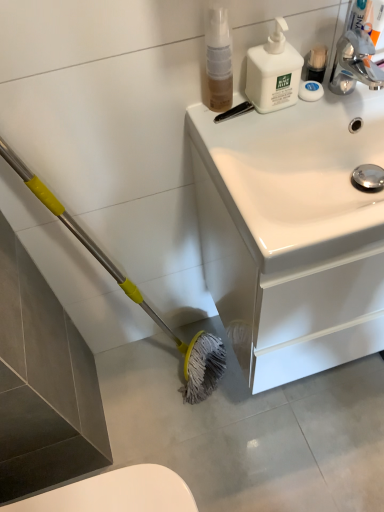
Locate an element on the screen. white glossy sink at upper right is located at coordinates tap(294, 230).

From the image's perspective, is white glossy sink at upper right positioned above or below white matte soap at upper right?

Based on their image positions, white glossy sink at upper right is located beneath white matte soap at upper right.

Does point (266, 195) come in front of point (319, 94)?

Yes, it is.

Is white glossy sink at upper right touching white matte soap at upper right?

No, white glossy sink at upper right is not making contact with white matte soap at upper right.

Could you tell me if white glossy sink at upper right is turned towards white matte soap at upper right?

No.

How many degrees apart are the facing directions of white matte soap at upper right and white glossy sink at upper right?

2.67 degrees.

Is white matte soap at upper right turned away from white glossy sink at upper right?

No, white glossy sink at upper right is not at the back of white matte soap at upper right.

From the image's perspective, does white matte soap at upper right appear higher than white glossy sink at upper right?

Indeed, from the image's perspective, white matte soap at upper right is shown above white glossy sink at upper right.

Consider the image. Is white matte soap at upper right next to white glossy sink at upper right and touching it?

white matte soap at upper right and white glossy sink at upper right are clearly separated.

Considering the relative sizes of translucent plastic spray bottle at upper center, marked as the 1th cleaning product in a left-to-right arrangement, and white glossy sink at upper right in the image provided, is translucent plastic spray bottle at upper center, marked as the 1th cleaning product in a left-to-right arrangement, shorter than white glossy sink at upper right?

Yes, translucent plastic spray bottle at upper center, marked as the 1th cleaning product in a left-to-right arrangement, is shorter than white glossy sink at upper right.

What's the angular difference between translucent plastic spray bottle at upper center, marked as the 1th cleaning product in a left-to-right arrangement, and white glossy sink at upper right's facing directions?

The angular difference between translucent plastic spray bottle at upper center, marked as the 1th cleaning product in a left-to-right arrangement, and white glossy sink at upper right is 3.02 degrees.

Could you tell me if translucent plastic spray bottle at upper center, marked as the 1th cleaning product in a left-to-right arrangement, is turned towards white glossy sink at upper right?

No.

In terms of size, does translucent plastic spray bottle at upper center, placed as the 2th cleaning product when sorted from right to left, appear bigger or smaller than white glossy sink at upper right?

Considering their sizes, translucent plastic spray bottle at upper center, placed as the 2th cleaning product when sorted from right to left, takes up less space than white glossy sink at upper right.

Looking at this image, which is more to the right, white matte pump bottle at upper right, which appears as the 1th cleaning product when viewed from the right, or white matte soap at upper right?

From the viewer's perspective, white matte soap at upper right appears more on the right side.

From a real-world perspective, starting from the white matte soap at upper right, which cleaning product is the 1st one vertically above it? Please provide its 2D coordinates.

[(273, 72)]

Is white matte pump bottle at upper right, the second cleaning product in the left-to-right sequence, placed right next to white matte soap at upper right?

Yes, white matte pump bottle at upper right, the second cleaning product in the left-to-right sequence, is with white matte soap at upper right.

Between white matte pump bottle at upper right, which appears as the 1th cleaning product when viewed from the right, and white matte soap at upper right, which one is positioned in front?

white matte pump bottle at upper right, which appears as the 1th cleaning product when viewed from the right, is more forward.

Who is bigger, white matte pump bottle at upper right, the second cleaning product in the left-to-right sequence, or translucent plastic spray bottle at upper center, marked as the 1th cleaning product in a left-to-right arrangement?

Bigger between the two is white matte pump bottle at upper right, the second cleaning product in the left-to-right sequence.

In terms of height, does white matte pump bottle at upper right, which appears as the 1th cleaning product when viewed from the right, look taller or shorter compared to translucent plastic spray bottle at upper center, placed as the 2th cleaning product when sorted from right to left?

Considering their sizes, white matte pump bottle at upper right, which appears as the 1th cleaning product when viewed from the right, has less height than translucent plastic spray bottle at upper center, placed as the 2th cleaning product when sorted from right to left.

From the image's perspective, relative to translucent plastic spray bottle at upper center, placed as the 2th cleaning product when sorted from right to left, is white matte pump bottle at upper right, which appears as the 1th cleaning product when viewed from the right, above or below?

Based on their image positions, white matte pump bottle at upper right, which appears as the 1th cleaning product when viewed from the right, is located beneath translucent plastic spray bottle at upper center, placed as the 2th cleaning product when sorted from right to left.

Looking at this image, are white matte pump bottle at upper right, the second cleaning product in the left-to-right sequence, and translucent plastic spray bottle at upper center, marked as the 1th cleaning product in a left-to-right arrangement, far apart?

No, there isn't a large distance between white matte pump bottle at upper right, the second cleaning product in the left-to-right sequence, and translucent plastic spray bottle at upper center, marked as the 1th cleaning product in a left-to-right arrangement.

Does white glossy sink at upper right have a greater width compared to white matte pump bottle at upper right, the second cleaning product in the left-to-right sequence?

Yes, white glossy sink at upper right is wider than white matte pump bottle at upper right, the second cleaning product in the left-to-right sequence.

From a real-world perspective, which object stands above the other?

From a 3D spatial view, white matte pump bottle at upper right, which appears as the 1th cleaning product when viewed from the right, is above.

Does white glossy sink at upper right turn towards white matte pump bottle at upper right, the second cleaning product in the left-to-right sequence?

No.

Is white glossy sink at upper right with white matte pump bottle at upper right, the second cleaning product in the left-to-right sequence?

No, white glossy sink at upper right is not with white matte pump bottle at upper right, the second cleaning product in the left-to-right sequence.

Measure the distance between white glossy sink at upper right and translucent plastic spray bottle at upper center, placed as the 2th cleaning product when sorted from right to left.

white glossy sink at upper right is 13.26 inches from translucent plastic spray bottle at upper center, placed as the 2th cleaning product when sorted from right to left.

Which object is thinner, white glossy sink at upper right or translucent plastic spray bottle at upper center, marked as the 1th cleaning product in a left-to-right arrangement?

With smaller width is translucent plastic spray bottle at upper center, marked as the 1th cleaning product in a left-to-right arrangement.

Which is less distant, [246,221] or [218,31]?

Point [246,221].

Image resolution: width=384 pixels, height=512 pixels. In the image, there is a white matte soap at upper right. Identify the location of bathroom cabinet below it (from the image's perspective). (294, 230).

This screenshot has width=384, height=512. Find the location of `soap above the white glossy sink at upper right (from the image's perspective)`. soap above the white glossy sink at upper right (from the image's perspective) is located at coordinates (310, 91).

Looking at the image, which one is located further to white matte pump bottle at upper right, which appears as the 1th cleaning product when viewed from the right, white matte soap at upper right or translucent plastic spray bottle at upper center, marked as the 1th cleaning product in a left-to-right arrangement?

Among the two, translucent plastic spray bottle at upper center, marked as the 1th cleaning product in a left-to-right arrangement, is located further to white matte pump bottle at upper right, which appears as the 1th cleaning product when viewed from the right.

Based on their spatial positions, is white matte pump bottle at upper right, which appears as the 1th cleaning product when viewed from the right, or white glossy sink at upper right further from translucent plastic spray bottle at upper center, marked as the 1th cleaning product in a left-to-right arrangement?

white glossy sink at upper right is further to translucent plastic spray bottle at upper center, marked as the 1th cleaning product in a left-to-right arrangement.

From the image, which object appears to be nearer to white matte soap at upper right, white glossy sink at upper right or white matte pump bottle at upper right, the second cleaning product in the left-to-right sequence?

Among the two, white matte pump bottle at upper right, the second cleaning product in the left-to-right sequence, is located nearer to white matte soap at upper right.

Estimate the real-world distances between objects in this image. Which object is further from translucent plastic spray bottle at upper center, placed as the 2th cleaning product when sorted from right to left, white glossy sink at upper right or white matte pump bottle at upper right, which appears as the 1th cleaning product when viewed from the right?

white glossy sink at upper right.

Consider the image. Considering their positions, is translucent plastic spray bottle at upper center, marked as the 1th cleaning product in a left-to-right arrangement, positioned closer to white matte soap at upper right than white glossy sink at upper right?

translucent plastic spray bottle at upper center, marked as the 1th cleaning product in a left-to-right arrangement, lies closer to white matte soap at upper right than the other object.

Which object lies further to the anchor point white matte soap at upper right, white matte pump bottle at upper right, the second cleaning product in the left-to-right sequence, or translucent plastic spray bottle at upper center, marked as the 1th cleaning product in a left-to-right arrangement?

Among the two, translucent plastic spray bottle at upper center, marked as the 1th cleaning product in a left-to-right arrangement, is located further to white matte soap at upper right.

Looking at the image, which one is located further to translucent plastic spray bottle at upper center, placed as the 2th cleaning product when sorted from right to left, white matte soap at upper right or white matte pump bottle at upper right, which appears as the 1th cleaning product when viewed from the right?

The object further to translucent plastic spray bottle at upper center, placed as the 2th cleaning product when sorted from right to left, is white matte soap at upper right.

Based on the photo, considering their positions, is translucent plastic spray bottle at upper center, marked as the 1th cleaning product in a left-to-right arrangement, positioned closer to white matte pump bottle at upper right, which appears as the 1th cleaning product when viewed from the right, than white glossy sink at upper right?

translucent plastic spray bottle at upper center, marked as the 1th cleaning product in a left-to-right arrangement, lies closer to white matte pump bottle at upper right, which appears as the 1th cleaning product when viewed from the right, than the other object.

Find the location of a particular element. The image size is (384, 512). cleaning product between translucent plastic spray bottle at upper center, placed as the 2th cleaning product when sorted from right to left, and white glossy sink at upper right in the up-down direction is located at coordinates (273, 72).

This screenshot has height=512, width=384. Find the location of `cleaning product located between translucent plastic spray bottle at upper center, placed as the 2th cleaning product when sorted from right to left, and white matte soap at upper right in the left-right direction`. cleaning product located between translucent plastic spray bottle at upper center, placed as the 2th cleaning product when sorted from right to left, and white matte soap at upper right in the left-right direction is located at coordinates (273, 72).

Locate an element on the screen. soap between translucent plastic spray bottle at upper center, placed as the 2th cleaning product when sorted from right to left, and white glossy sink at upper right from top to bottom is located at coordinates (310, 91).

Where is `soap between white matte pump bottle at upper right, which appears as the 1th cleaning product when viewed from the right, and white glossy sink at upper right in the up-down direction`? This screenshot has width=384, height=512. soap between white matte pump bottle at upper right, which appears as the 1th cleaning product when viewed from the right, and white glossy sink at upper right in the up-down direction is located at coordinates (310, 91).